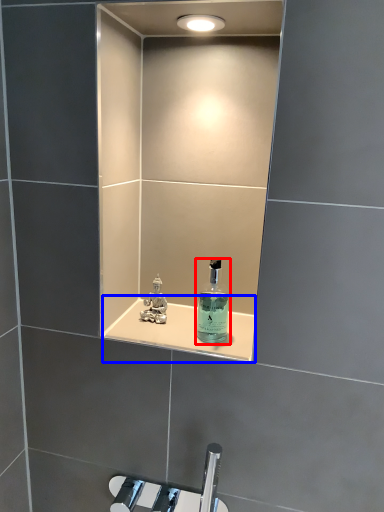
Question: Which object is further to the camera taking this photo, bottle (highlighted by a red box) or shelve (highlighted by a blue box)?

Choices:
 (A) bottle
 (B) shelve

Answer: (B)